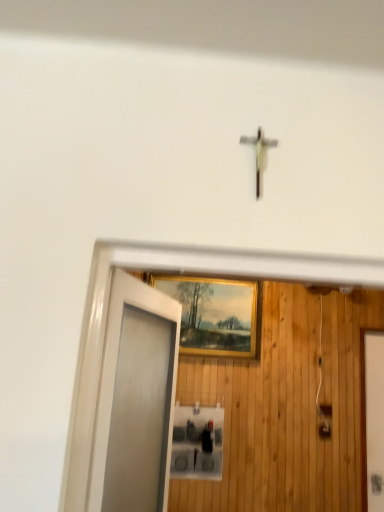
At what (x,y) coordinates should I click in order to perform the action: click on frosted glass door at left. Please return your answer as a coordinate pair (x, y). Looking at the image, I should click on (135, 400).

The height and width of the screenshot is (512, 384). Describe the element at coordinates (372, 420) in the screenshot. I see `white glossy elevator door at right` at that location.

Find the location of a particular element. The image size is (384, 512). frosted glass door at left is located at coordinates (135, 400).

Would you consider frosted glass door at left to be distant from gold-framed painting at center?

Yes.

Is frosted glass door at left aimed at gold-framed painting at center?

No.

From the picture: From the image's perspective, is frosted glass door at left located above gold-framed painting at center?

No, from the image's perspective, frosted glass door at left is not above gold-framed painting at center.

Is frosted glass door at left bigger or smaller than gold-framed painting at center?

Considering their sizes, frosted glass door at left takes up more space than gold-framed painting at center.

From the image's perspective, which one is positioned lower, gold-framed painting at center or white glossy elevator door at right?

white glossy elevator door at right, from the image's perspective.

Is gold-framed painting at center touching white glossy elevator door at right?

gold-framed painting at center is not next to white glossy elevator door at right, and they're not touching.

Who is shorter, gold-framed painting at center or white glossy elevator door at right?

gold-framed painting at center is shorter.

Between frosted glass door at left and white glossy elevator door at right, which one has less height?

Standing shorter between the two is frosted glass door at left.

How many degrees apart are the facing directions of frosted glass door at left and white glossy elevator door at right?

The angular difference between frosted glass door at left and white glossy elevator door at right is 72.2 degrees.

In the image, is frosted glass door at left positioned in front of or behind white glossy elevator door at right?

Visually, frosted glass door at left is located in front of white glossy elevator door at right.

Is white glossy elevator door at right at the back of frosted glass door at left?

No, frosted glass door at left's orientation is not away from white glossy elevator door at right.

I want to click on picture frame on the right of frosted glass door at left, so 214,314.

From the image's perspective, which one is positioned lower, gold-framed painting at center or frosted glass door at left?

frosted glass door at left is shown below in the image.

How many degrees apart are the facing directions of gold-framed painting at center and frosted glass door at left?

gold-framed painting at center and frosted glass door at left are facing 73.3 degrees away from each other.

Which is more to the left, gold-framed painting at center or frosted glass door at left?

frosted glass door at left.

Looking at the image, does white glossy elevator door at right seem bigger or smaller compared to frosted glass door at left?

In the image, white glossy elevator door at right appears to be smaller than frosted glass door at left.

Does point (378, 334) come closer to viewer compared to point (135, 305)?

No, it is not.

Is white glossy elevator door at right positioned with its back to frosted glass door at left?

That's not correct — white glossy elevator door at right is not looking away from frosted glass door at left.

How different are the orientations of white glossy elevator door at right and gold-framed painting at center in degrees?

The angular difference between white glossy elevator door at right and gold-framed painting at center is 1.09 degrees.

This screenshot has height=512, width=384. I want to click on picture frame that is behind the white glossy elevator door at right, so click(214, 314).

Does white glossy elevator door at right have a greater height compared to gold-framed painting at center?

Yes, white glossy elevator door at right is taller than gold-framed painting at center.

Between white glossy elevator door at right and gold-framed painting at center, which one has smaller size?

white glossy elevator door at right.

Where is `picture frame that is on the right side of frosted glass door at left`? This screenshot has width=384, height=512. picture frame that is on the right side of frosted glass door at left is located at coordinates (214, 314).

The image size is (384, 512). Identify the location of picture frame above the white glossy elevator door at right (from a real-world perspective). (214, 314).

In the scene shown: Looking at the image, which one is located closer to white glossy elevator door at right, gold-framed painting at center or frosted glass door at left?

gold-framed painting at center.

Based on their spatial positions, is frosted glass door at left or gold-framed painting at center further from white glossy elevator door at right?

frosted glass door at left lies further to white glossy elevator door at right than the other object.

When comparing their distances from gold-framed painting at center, does frosted glass door at left or white glossy elevator door at right seem closer?

Based on the image, white glossy elevator door at right appears to be nearer to gold-framed painting at center.

Looking at the image, which one is located further to frosted glass door at left, gold-framed painting at center or white glossy elevator door at right?

Based on the image, white glossy elevator door at right appears to be further to frosted glass door at left.

Considering their positions, is white glossy elevator door at right positioned closer to frosted glass door at left than gold-framed painting at center?

gold-framed painting at center.

When comparing their distances from gold-framed painting at center, does white glossy elevator door at right or frosted glass door at left seem further?

Among the two, frosted glass door at left is located further to gold-framed painting at center.

Where is `elevator door between frosted glass door at left and gold-framed painting at center in the front-back direction`? This screenshot has height=512, width=384. elevator door between frosted glass door at left and gold-framed painting at center in the front-back direction is located at coordinates (372, 420).